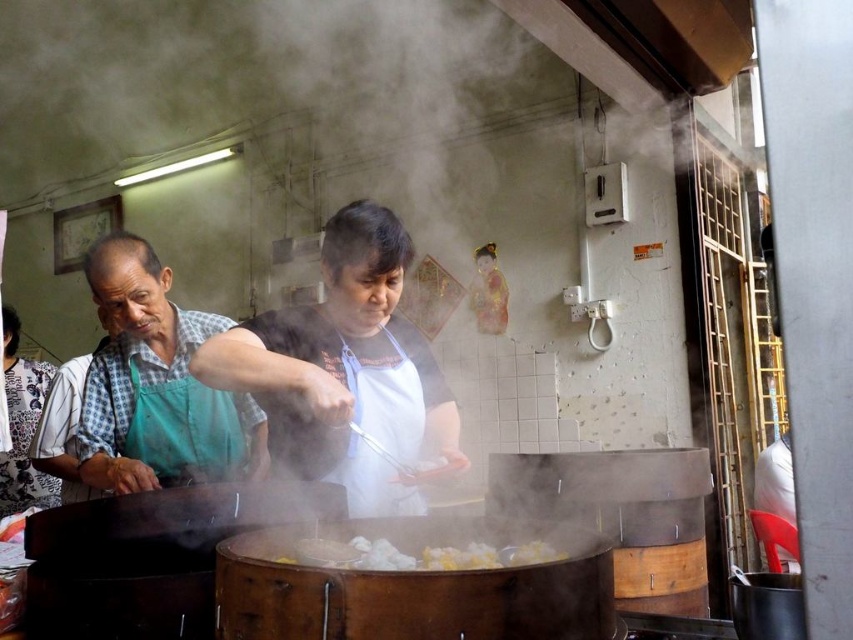
Is green apron at left thinner than white fluffy dumplings at center?

No, green apron at left is not thinner than white fluffy dumplings at center.

Who is lower down, green apron at left or white fluffy dumplings at center?

white fluffy dumplings at center is lower down.

Find the location of a particular element. This screenshot has height=640, width=853. green apron at left is located at coordinates (155, 385).

What are the coordinates of `green apron at left` in the screenshot? It's located at (155, 385).

Does white apron at center have a greater height compared to green apron at left?

Indeed, white apron at center has a greater height compared to green apron at left.

Is point (322, 408) positioned in front of point (259, 442)?

Yes, point (322, 408) is in front of point (259, 442).

Is point (352, 225) positioned after point (219, 444)?

No, it is not.

Locate an element on the screen. The width and height of the screenshot is (853, 640). white apron at center is located at coordinates (344, 369).

Who is more forward, (x=389, y=374) or (x=529, y=548)?

Point (x=529, y=548)

Describe the element at coordinates (344, 369) in the screenshot. I see `white apron at center` at that location.

Is point (328, 449) farther from viewer compared to point (393, 561)?

Yes, point (328, 449) is behind point (393, 561).

The image size is (853, 640). Identify the location of white apron at center. (344, 369).